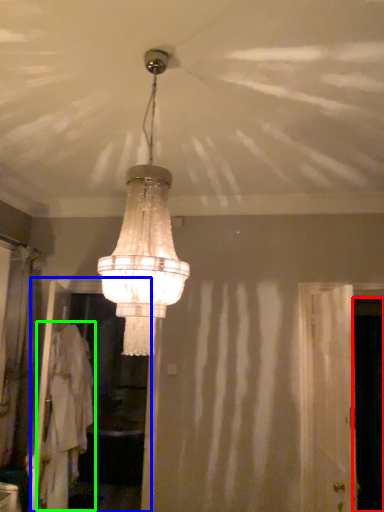
Question: Based on their relative distances, which object is farther from screen door (highlighted by a red box)? Choose from screen door (highlighted by a blue box) and robe (highlighted by a green box).

Choices:
 (A) screen door
 (B) robe

Answer: (A)